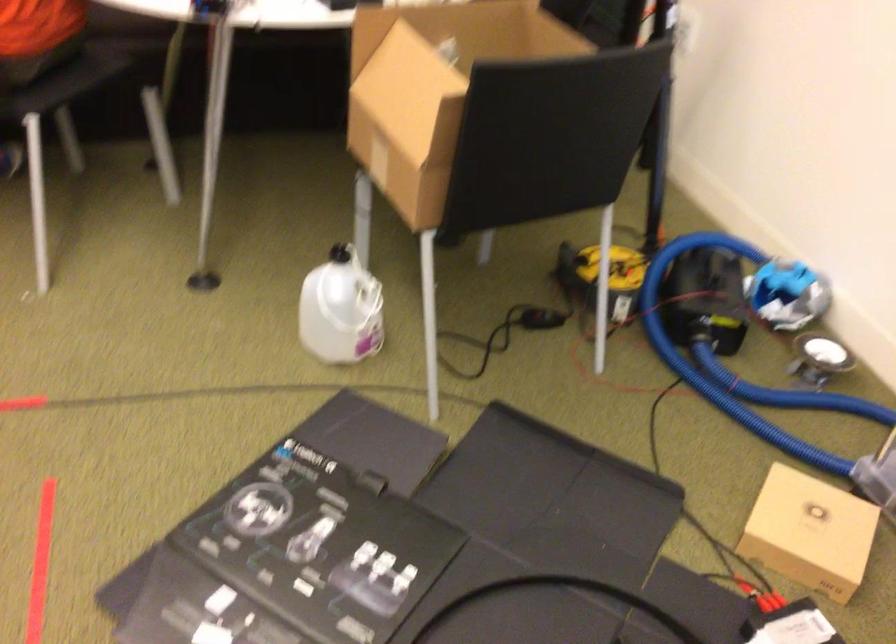
What are the coordinates of `cardboard box` in the screenshot? It's located at (431, 88).